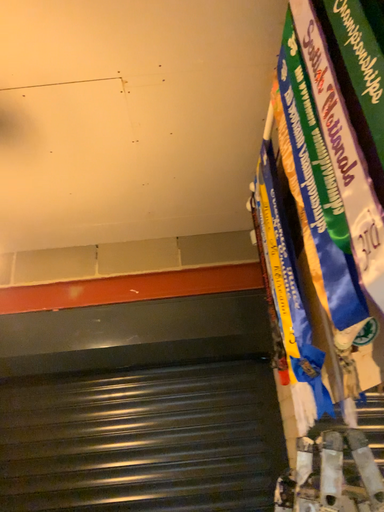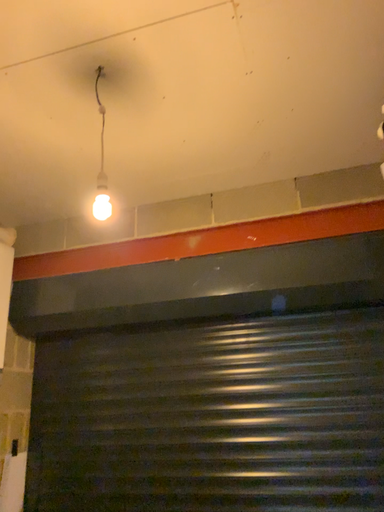
Question: How did the camera likely rotate when shooting the video?

Choices:
 (A) rotated left
 (B) rotated right

Answer: (A)